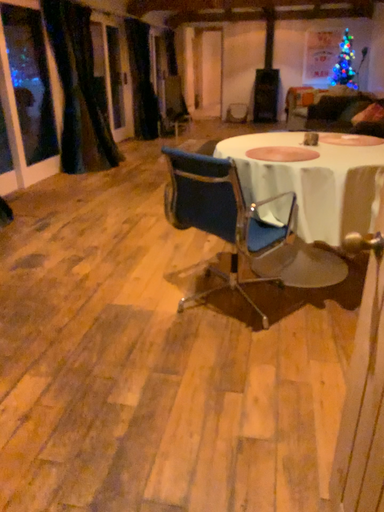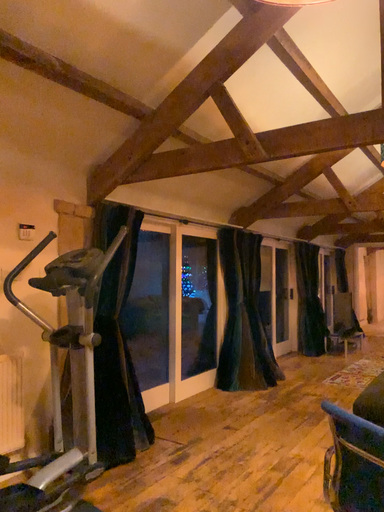
Question: How did the camera likely rotate when shooting the video?

Choices:
 (A) rotated downward
 (B) rotated upward

Answer: (B)